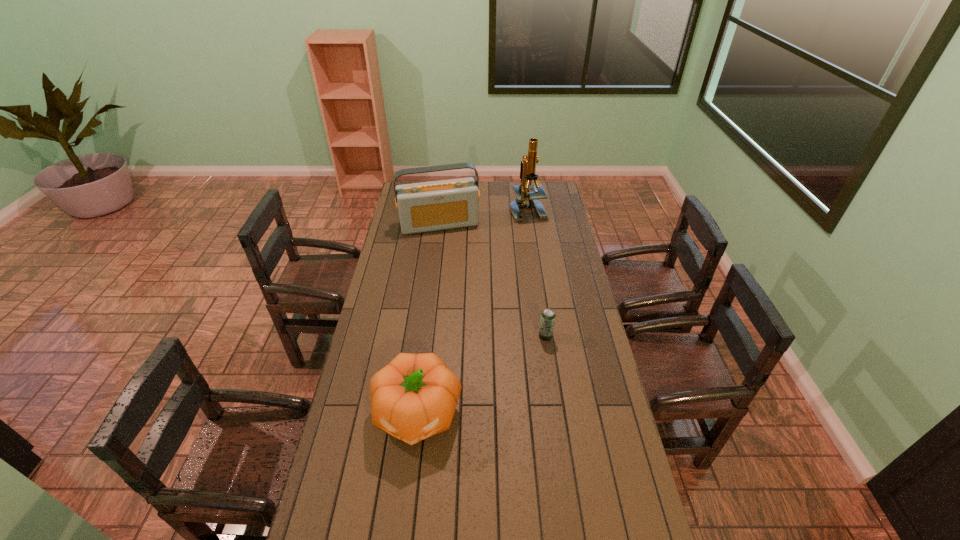
Identify the location of the third tallest object. This screenshot has height=540, width=960. (414, 397).

You are a GUI agent. You are given a task and a screenshot of the screen. Output one action in this format:
    pyautogui.click(x=<x>, y=<y>)
    Task: Click on the nearest object
    This screenshot has height=540, width=960.
    Given the screenshot: What is the action you would take?
    pyautogui.click(x=414, y=397)

Where is `beer can`? This screenshot has width=960, height=540. beer can is located at coordinates (547, 321).

Locate an element on the screen. the shortest object is located at coordinates (547, 321).

Locate an element on the screen. the second tallest object is located at coordinates (437, 205).

Identify the location of microscope. Image resolution: width=960 pixels, height=540 pixels. (524, 199).

Identify the location of free space located 0.060m on the carved face of the pumpkin. (410, 476).

Image resolution: width=960 pixels, height=540 pixels. Identify the location of vacant space located on the front of the second nearest object. (559, 426).

You are a GUI agent. You are given a task and a screenshot of the screen. Output one action in this format:
    pyautogui.click(x=<x>, y=<y>)
    Task: Click on the blank area located on the front-facing side of the radio receiver
    The height and width of the screenshot is (540, 960).
    Given the screenshot: What is the action you would take?
    pyautogui.click(x=463, y=287)

Identify the location of free spot located on the front-facing side of the radio receiver. The width and height of the screenshot is (960, 540). (457, 268).